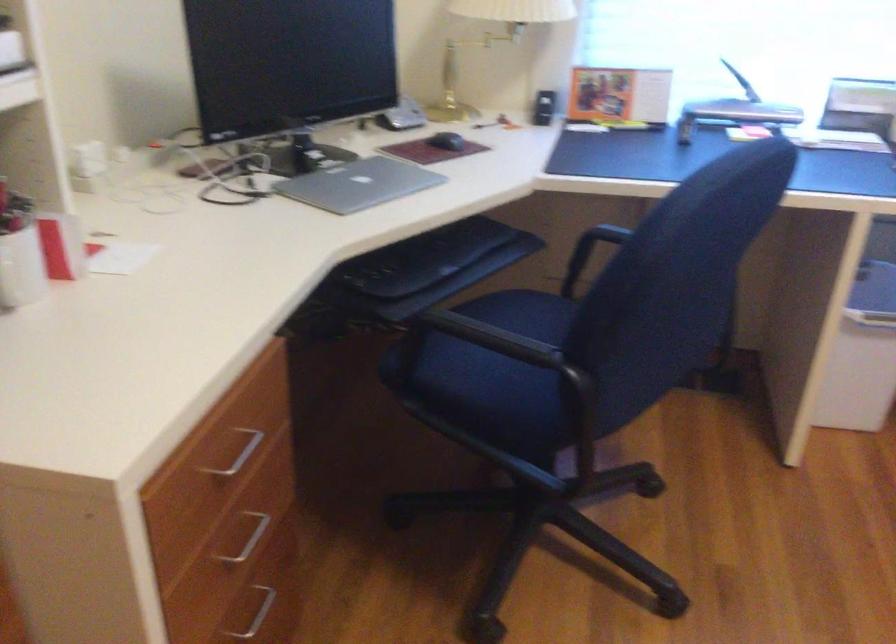
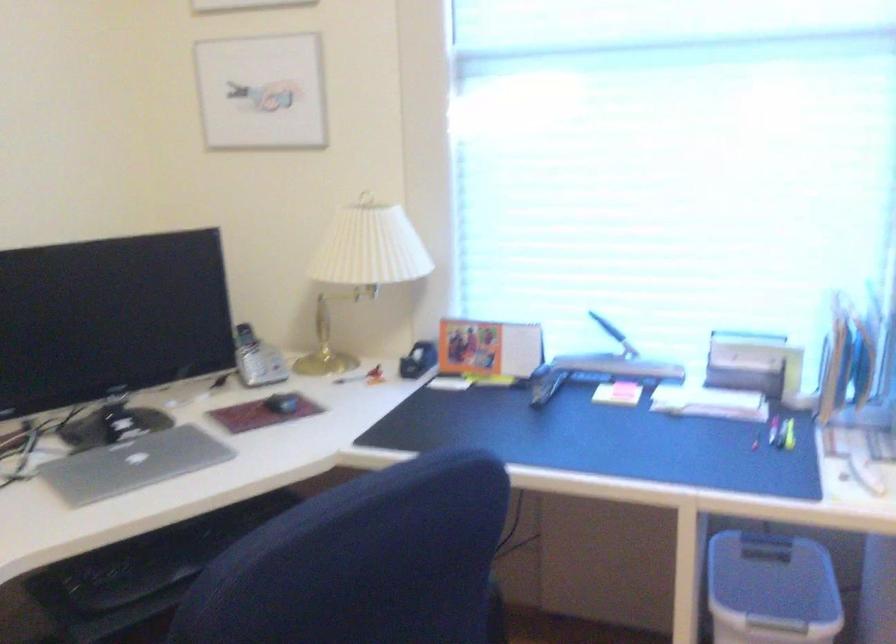
Where in the second image is the point corresponding to (734,73) from the first image?

(607, 327)